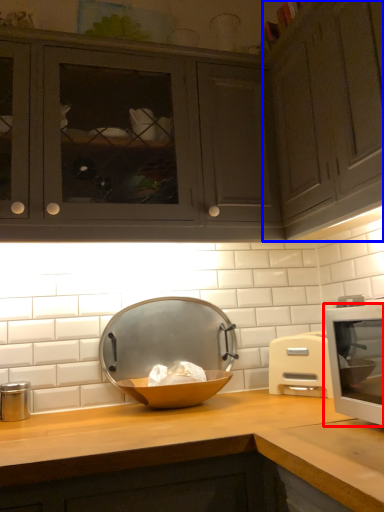
Question: Which of the following is the farthest to the observer, home appliance (highlighted by a red box) or cabinetry (highlighted by a blue box)?

Choices:
 (A) home appliance
 (B) cabinetry

Answer: (B)